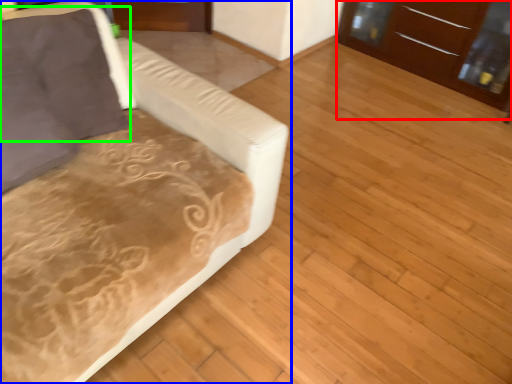
Question: Which object is the closest to the dresser (highlighted by a red box)? Choose among these: studio couch (highlighted by a blue box) or pillow (highlighted by a green box).

Choices:
 (A) studio couch
 (B) pillow

Answer: (A)